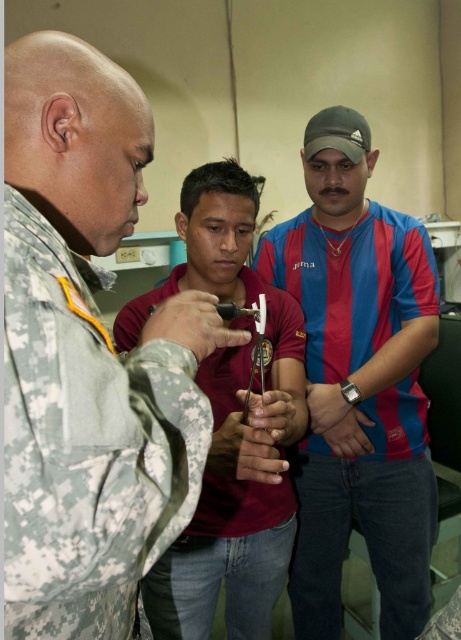
You are a photographer standing behind the blue striped shirt at center and camouflage fabric uniform at center. You want to take a photo of both subjects so that both their faces are fully visible. Based on their heights, which subject should you position closer to the camera to ensure both faces are visible without obstruction?

The blue striped shirt at center is taller than the camouflage fabric uniform at center. To ensure both faces are visible, position the camouflage fabric uniform at center closer to the camera so their face isn not blocked by the taller blue striped shirt at center.

You are standing at the point with coordinates point (43, 611) and want to walk to the point with coordinates point (420, 492). Which direction should you move?

You should move backward because point (43, 611) is in front of point (420, 492).